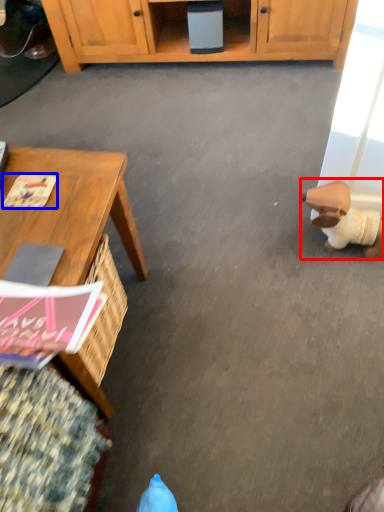
Question: Which object appears closest to the camera in this image, toy (highlighted by a red box) or magazine (highlighted by a blue box)?

Choices:
 (A) toy
 (B) magazine

Answer: (B)